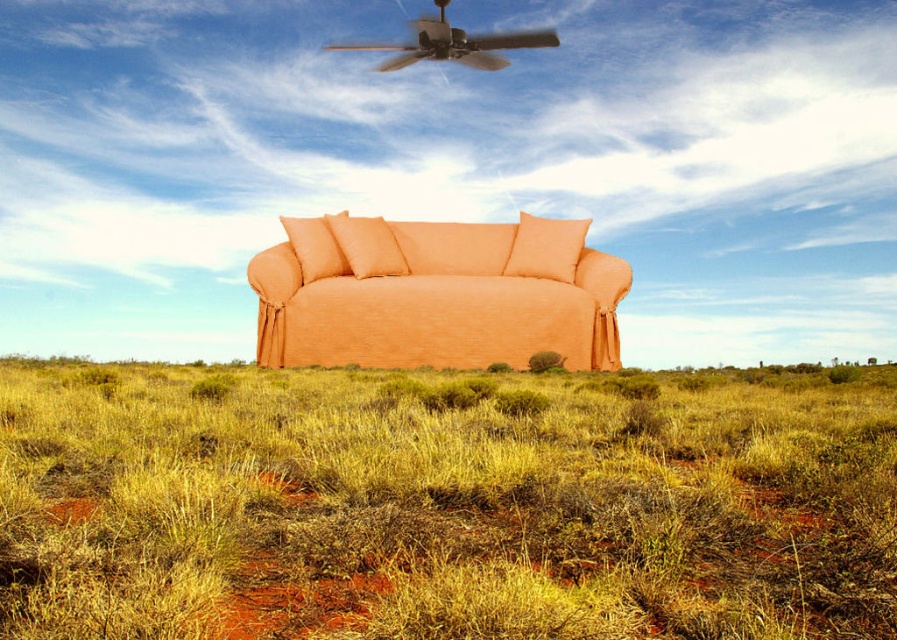
You are an interior designer assessing the placement of the orange fabric couch at center and the orange fabric pillow at center in the surreal outdoor setting. Which object has a greater width?

The orange fabric couch at center has a greater width than the orange fabric pillow at center.

You are a delivery person who needs to place a new orange fabric pillow at center on top of the orange fabric couch at center. The pillow is 30 inches wide. Can you fit the pillow on the couch without overlapping the edges?

The distance between the orange fabric couch at center and orange fabric pillow at center is 30.15 inches. Since the pillow is 30 inches wide, it can fit on the couch with a small gap of 0.15 inches remaining.

You are a photographer setting up a shoot on the peach sofa. You have a yellow dry grass at lower center and an orange fabric pillow at center. Which object is positioned to the right side of the other?

The orange fabric pillow at center is positioned to the right of the yellow dry grass at lower center because the yellow dry grass at lower center is to the left of orange fabric pillow at center.